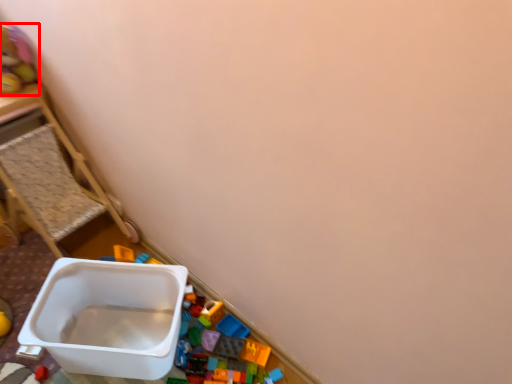
Question: In this image, where is toy (annotated by the red box) located relative to furniture?

Choices:
 (A) right
 (B) left

Answer: (B)